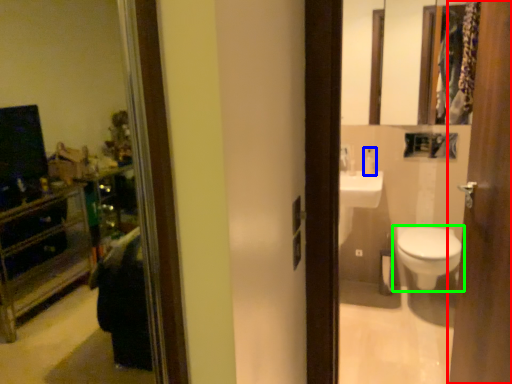
Question: Which object is the closest to the door (highlighted by a red box)? Choose among these: toiletry (highlighted by a blue box) or toilet (highlighted by a green box).

Choices:
 (A) toiletry
 (B) toilet

Answer: (B)